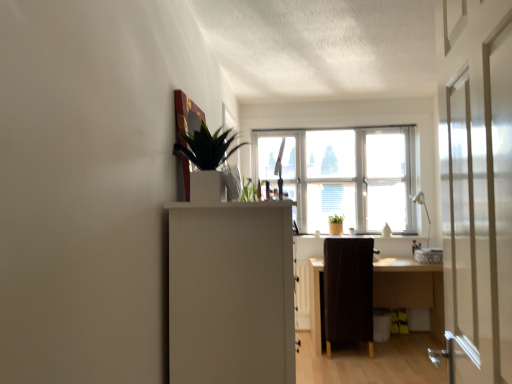
Question: From the image's perspective, is white glossy window sill at center located above or below white glossy screen door at right?

Choices:
 (A) above
 (B) below

Answer: (B)

Question: Choose the correct answer: Is white glossy window sill at center inside white glossy screen door at right or outside it?

Choices:
 (A) outside
 (B) inside

Answer: (A)

Question: Which object is the farthest from the white matte cabinet at center?

Choices:
 (A) transparent glass window at center
 (B) white glossy screen door at right
 (C) green glossy plant at upper center
 (D) dark brown fabric chair at center
 (E) white glossy window sill at center

Answer: (A)

Question: Considering the real-world distances, which object is closest to the transparent glass window at center?

Choices:
 (A) wooden desk at center
 (B) white glossy screen door at right
 (C) white matte cabinet at center
 (D) green glossy plant at upper center
 (E) dark brown fabric chair at center

Answer: (A)